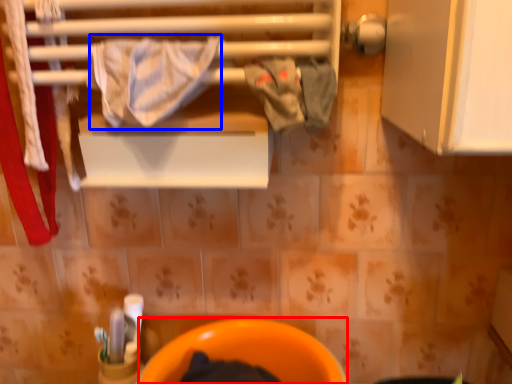
Question: Which object appears farthest to the camera in this image, toilet bowl (highlighted by a red box) or bath towel (highlighted by a blue box)?

Choices:
 (A) toilet bowl
 (B) bath towel

Answer: (A)